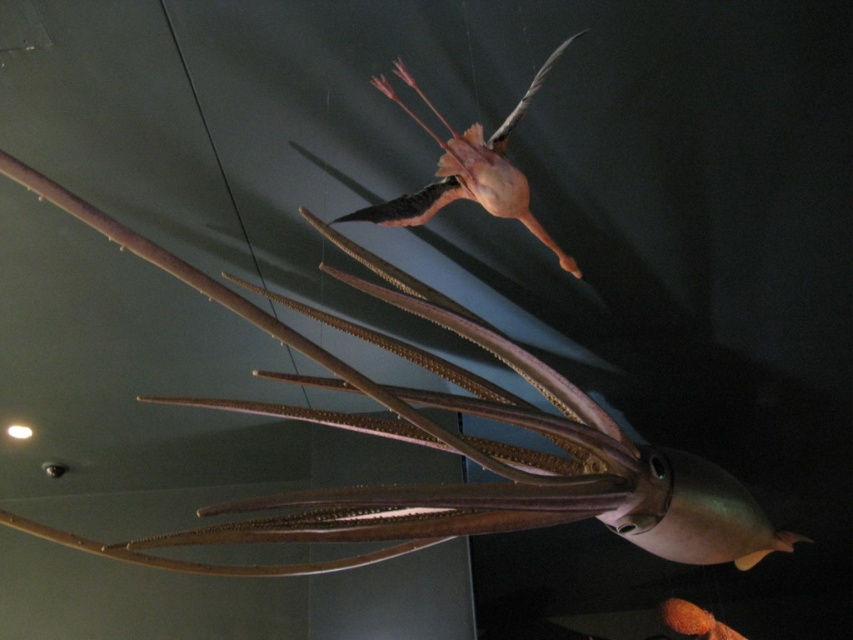
You are standing in front of the model squid exhibit and want to take a photo. There are two points marked on the squid model at coordinates point [606,458] and point [392,220]. Which point will appear closer to the camera in your photo?

Point [606,458] is further to the camera than point [392,220], so in the photo, point [606,458] will appear closer to the camera.

You are an art curator planning to install a new exhibit. You have a 12 inch wide display case. Can the shiny metallic squid at upper center and the pink matte squid at upper center both fit side by side in the display case without overlapping?

The shiny metallic squid at upper center is 13.52 inches from the pink matte squid at upper center, so they cannot fit side by side in a 12 inch wide display case without overlapping.